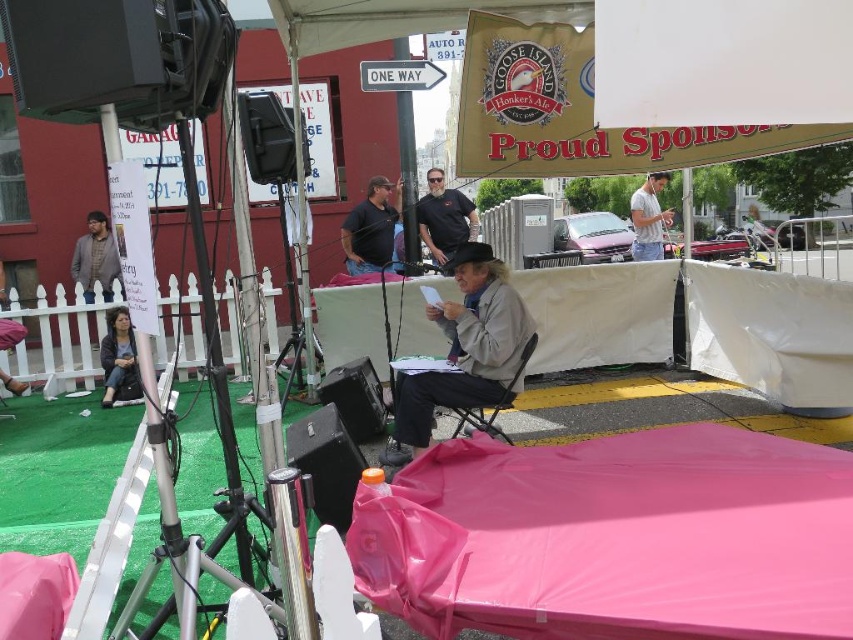
Is gray woolen jacket at center wider than black matte shirt at center?

Yes, gray woolen jacket at center is wider than black matte shirt at center.

Based on the photo, can you confirm if gray woolen jacket at center is shorter than black matte shirt at center?

Incorrect, gray woolen jacket at center's height does not fall short of black matte shirt at center's.

Is point (399, 384) positioned before point (428, 170)?

Yes.

Find the location of `gray woolen jacket at center`. gray woolen jacket at center is located at coordinates (467, 348).

Is gray woolen jacket at center taller than matte gray jacket at left?

Yes.

The width and height of the screenshot is (853, 640). What do you see at coordinates (467, 348) in the screenshot? I see `gray woolen jacket at center` at bounding box center [467, 348].

The height and width of the screenshot is (640, 853). Identify the location of gray woolen jacket at center. (467, 348).

Does dark gray sweater at lower left appear on the left side of matte gray jacket at left?

No, dark gray sweater at lower left is not to the left of matte gray jacket at left.

Does dark gray sweater at lower left appear under matte gray jacket at left?

Correct, dark gray sweater at lower left is located below matte gray jacket at left.

Between point (119, 372) and point (86, 237), which one is positioned in front?

Positioned in front is point (119, 372).

Where is `dark gray sweater at lower left`? dark gray sweater at lower left is located at coordinates (119, 358).